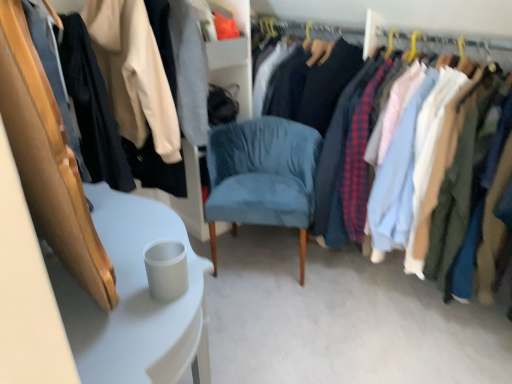
The width and height of the screenshot is (512, 384). Identify the location of vacant space underneath suede blue chair at center (from a real-world perspective). (263, 257).